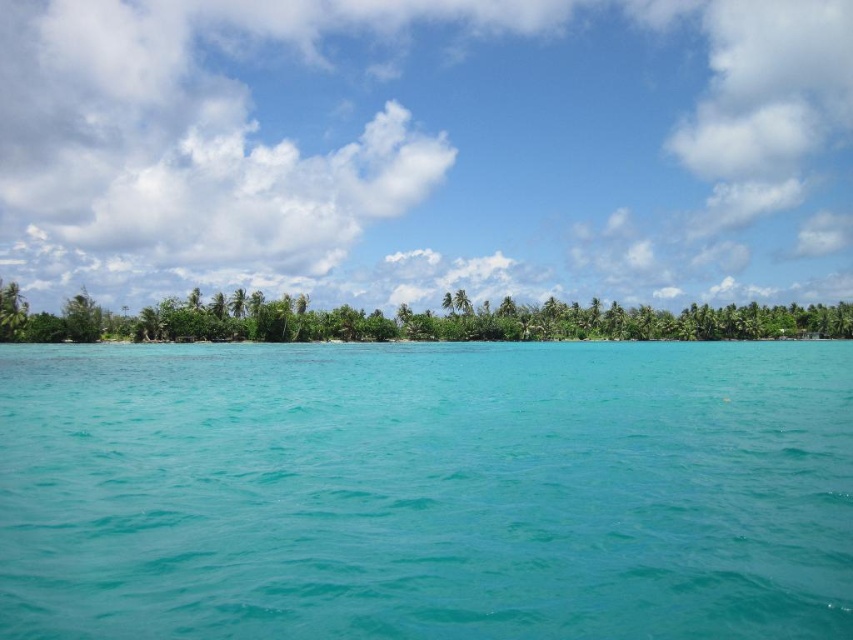
You are a photographer planning to capture the turquoise glossy water at center and the green leafy trees at center in a single shot. Based on the scene, which object will appear closer to the camera in the photo?

The turquoise glossy water at center will appear closer to the camera because it is shorter than the green leafy trees at center, making it positioned in the foreground.

You are a photographer planning to capture a landscape shot of the turquoise glossy water at center and green leafy trees at center. Based on their positions, which object will appear closer to the camera in the final photo?

The turquoise glossy water at center will appear closer to the camera in the final photo because it is positioned in front of the green leafy trees at center.

You are standing at the center of the image and want to reach the shoreline. Which direction should you move to get away from the turquoise glossy water at center?

The turquoise glossy water at center is located at point (426, 492), so to move away from it towards the shoreline, you should move in the opposite direction of the water. Since the water is at the center, moving towards the edges would take you away from it. The shoreline is in the midground, so moving towards the midground direction would lead you away from the water.